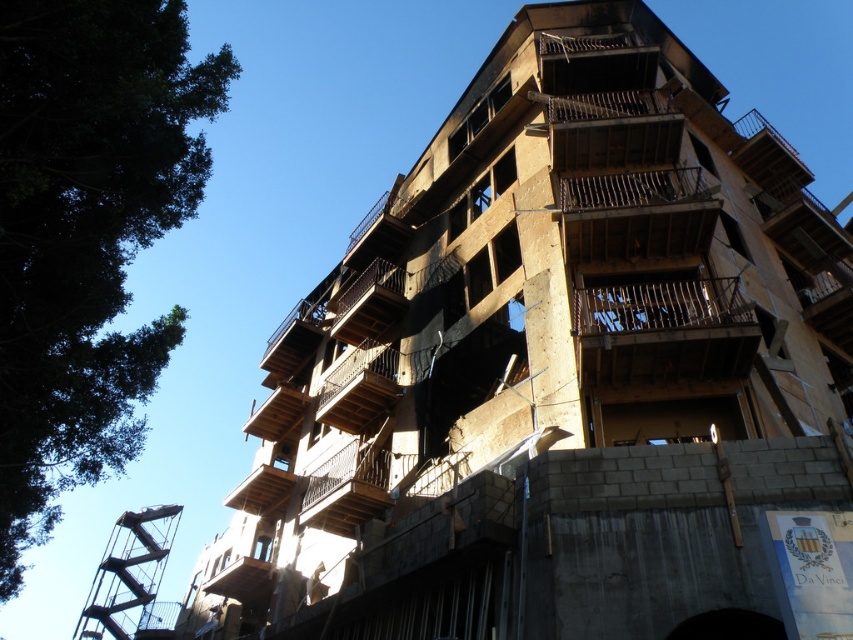
You are an architect inspecting the construction site. You notice the green leafy tree at upper left and the brown wooden balcony at center. Which object is closer to you from your current viewpoint?

The green leafy tree at upper left is closer to you because it is in front of the brown wooden balcony at center.

In the scene shown: You are an architect inspecting the construction site. You notice the green leafy tree at upper left and the brown wooden balcony at center. Which object occupies more space in the image?

The green leafy tree at upper left is larger in size than the brown wooden balcony at center, so it occupies more space in the image.